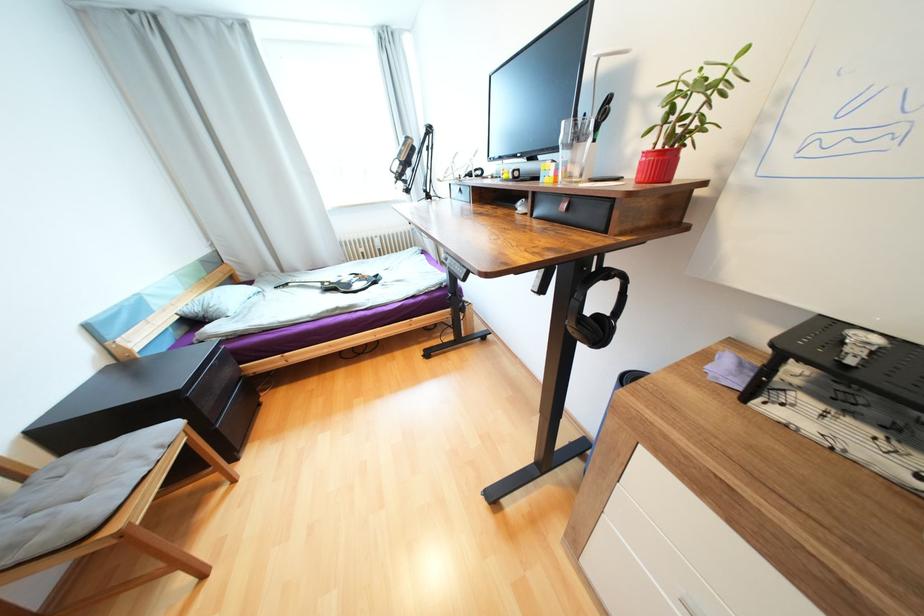
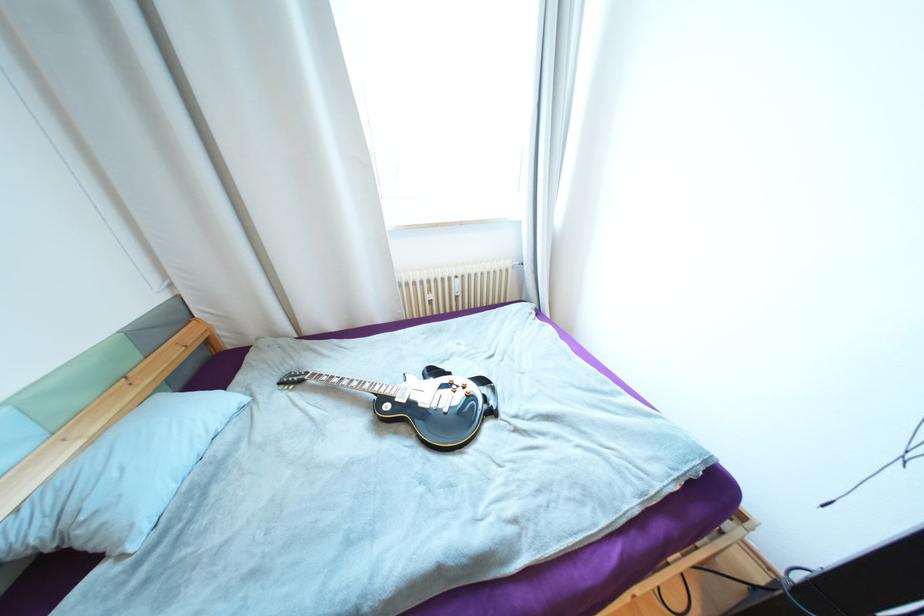
Which direction would the cameraman need to move to produce the second image?

The cameraman moved toward left, forward.